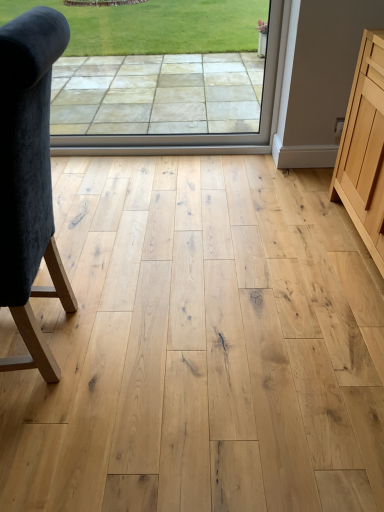
The image size is (384, 512). Find the location of `free location in front of transparent glass window at center`. free location in front of transparent glass window at center is located at coordinates (165, 204).